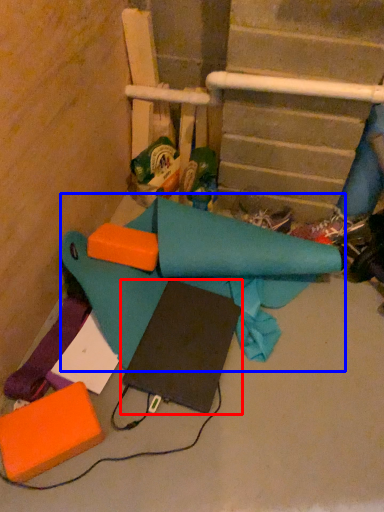
Question: Among these objects, which one is farthest to the camera, notebook (highlighted by a red box) or fabric (highlighted by a blue box)?

Choices:
 (A) notebook
 (B) fabric

Answer: (A)